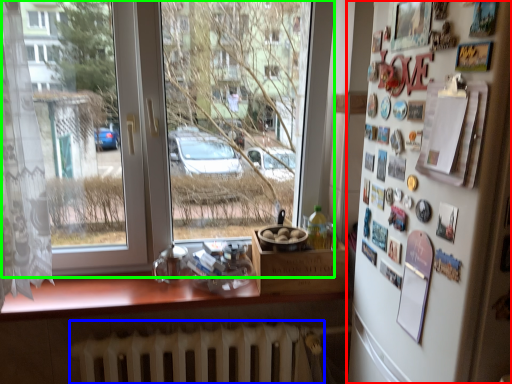
Question: Which object is positioned closest to mirror (highlighted by a red box)? Select from radiator (highlighted by a blue box) and window (highlighted by a green box).

Choices:
 (A) radiator
 (B) window

Answer: (A)